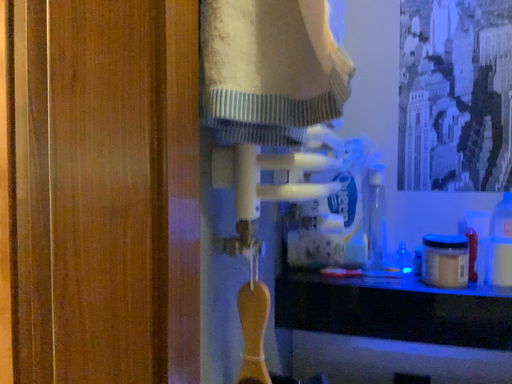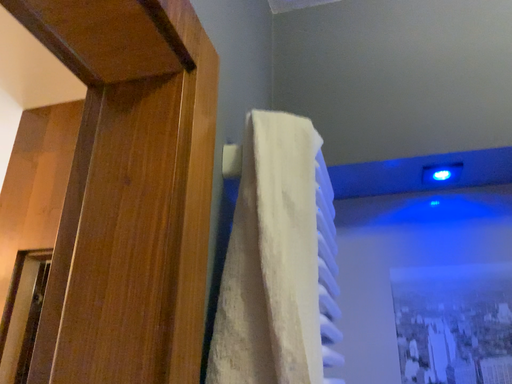
Question: How did the camera likely rotate when shooting the video?

Choices:
 (A) rotated upward
 (B) rotated downward

Answer: (A)